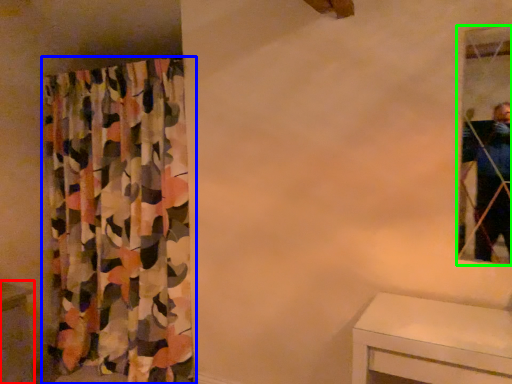
Question: Based on their relative distances, which object is farther from vanity (highlighted by a red box)? Choose from curtain (highlighted by a blue box) and mirror (highlighted by a green box).

Choices:
 (A) curtain
 (B) mirror

Answer: (B)